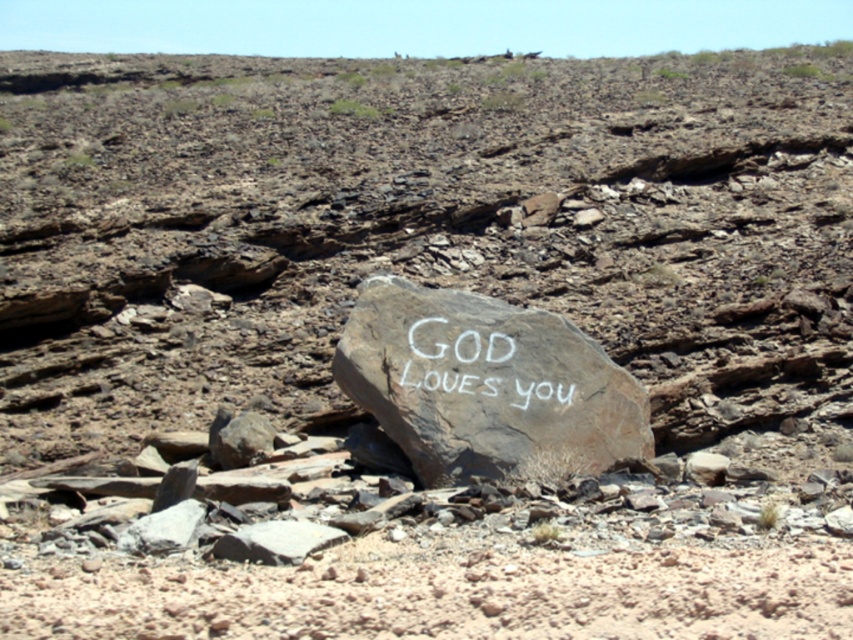
You are standing at the camera position and want to take a photo of the natural stone boulder at center. Is the distance between you and the boulder sufficient to capture it clearly with a standard camera lens?

The natural stone boulder at center and camera are 10.31 meters apart. A standard camera lens can focus at this distance, so yes, the distance is sufficient to capture the boulder clearly.

Consider the image. You are a hiker who wants to read the white chalk writing at center without getting too close to the natural stone boulder at center. Can you do that?

The natural stone boulder at center is below the white chalk writing at center, so the writing is positioned higher up. Since you can see the writing from a distance, you can read it without getting too close to the boulder.

You are a hiker who has stumbled upon this desert landscape. You notice the natural stone boulder at center and the white chalk writing at center. Which object is bigger in size?

The natural stone boulder at center is larger in size than the white chalk writing at center.